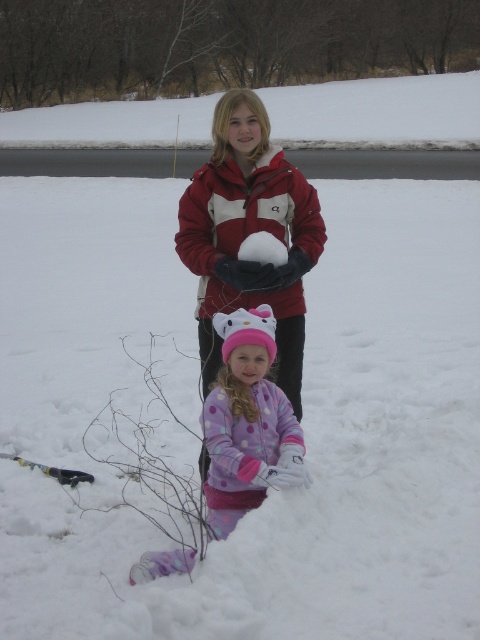
You are a photographer trying to capture both the matte red jacket at center and the white fluffy snowball at center in a single frame. Based on their sizes, which object will appear larger in the photo?

The matte red jacket at center will appear larger in the photo because it is bigger than the white fluffy snowball at center according to the description.

You are standing at the origin point of this snowy scene. You see two points marked in the image. Which point is closer to you, point (x=216, y=364) or point (x=94, y=477)?

Point (x=216, y=364) is in front of point (x=94, y=477), so it is closer to you.